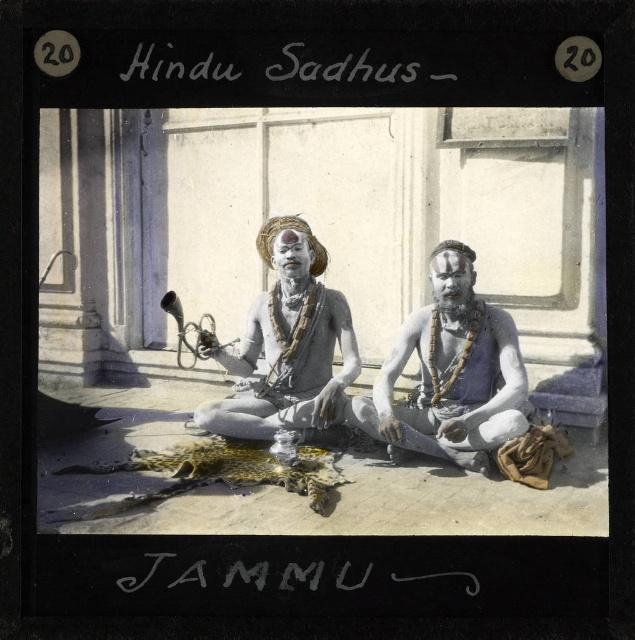
You are a photographer trying to capture both the white matte man at center and the white matte statue at center in a single frame. Given that your camera has a minimum focus distance of 10 inches, will you be able to focus on both subjects simultaneously?

The white matte man at center and white matte statue at center are 10.11 inches apart. Since the distance between them is slightly over 10 inches, your camera can focus on both subjects as they are within the minimum focus distance requirement.

You are standing at point A located at coordinates point [277,243] and want to walk to point B located at coordinates point [505,328]. Which direction should you move in to reach point B from point A?

To reach point B located at coordinates point [505,328] from point A located at coordinates point [277,243], you should move forward since point B is in front of point A.